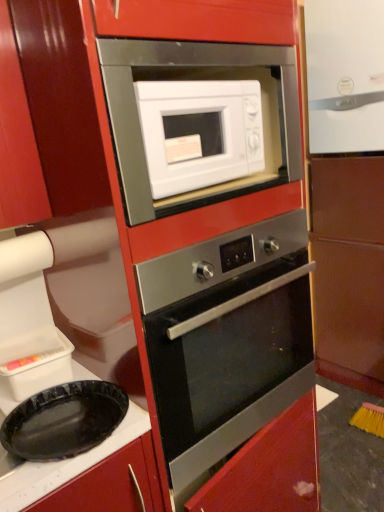
Image resolution: width=384 pixels, height=512 pixels. What do you see at coordinates (199, 133) in the screenshot?
I see `white glossy microwave at center` at bounding box center [199, 133].

The width and height of the screenshot is (384, 512). What do you see at coordinates (91, 475) in the screenshot? I see `black plastic plate at lower left` at bounding box center [91, 475].

Identify the location of white glossy refrigerator at upper right. Image resolution: width=384 pixels, height=512 pixels. (345, 75).

In order to click on matte brown cabinet at right in this screenshot , I will do `click(347, 184)`.

The height and width of the screenshot is (512, 384). What are the coordinates of `white glossy microwave at center` in the screenshot? It's located at (199, 133).

Where is `appliance above the white glossy microwave at center (from a real-world perspective)`? This screenshot has width=384, height=512. appliance above the white glossy microwave at center (from a real-world perspective) is located at coordinates (345, 75).

From a real-world perspective, which is physically above, white glossy microwave at center or white glossy refrigerator at upper right?

white glossy refrigerator at upper right is physically above.

Are white glossy microwave at center and white glossy refrigerator at upper right located far from each other?

That's right, there is a large distance between white glossy microwave at center and white glossy refrigerator at upper right.

In the image, is black plastic plate at lower left positioned in front of or behind white glossy microwave at center?

black plastic plate at lower left is in front of white glossy microwave at center.

Between black plastic plate at lower left and white glossy microwave at center, which one has larger size?

Bigger between the two is white glossy microwave at center.

Between black plastic plate at lower left and white glossy microwave at center, which one has more height?

With more height is white glossy microwave at center.

You are a GUI agent. You are given a task and a screenshot of the screen. Output one action in this format:
    pyautogui.click(x=<x>, y=<y>)
    Task: Click on the microwave oven lying on the right of black plastic plate at lower left
    This screenshot has width=384, height=512.
    Given the screenshot: What is the action you would take?
    pyautogui.click(x=199, y=133)

What's the angular difference between white glossy refrigerator at upper right and matte brown cabinet at right's facing directions?

They differ by 1.24 degrees in their facing directions.

Is point (377, 147) in front of point (380, 262)?

That is True.

From the image's perspective, which one is positioned lower, white glossy refrigerator at upper right or matte brown cabinet at right?

From the image's view, matte brown cabinet at right is below.

Considering the relative positions of white glossy refrigerator at upper right and matte brown cabinet at right in the image provided, is white glossy refrigerator at upper right behind matte brown cabinet at right?

That is True.

Does stainless steel oven at center lie in front of black plastic plate at lower left?

That is False.

From the image's perspective, is stainless steel oven at center located above or below black plastic plate at lower left?

Clearly, from the image's perspective, stainless steel oven at center is above black plastic plate at lower left.

From a real-world perspective, which is physically above, stainless steel oven at center or black plastic plate at lower left?

In real-world perspective, stainless steel oven at center is above.

The width and height of the screenshot is (384, 512). Find the location of `oven behind the black plastic plate at lower left`. oven behind the black plastic plate at lower left is located at coordinates (226, 339).

Is white glossy refrigerator at upper right in front of or behind stainless steel oven at center in the image?

white glossy refrigerator at upper right is behind stainless steel oven at center.

From the picture: Who is shorter, white glossy refrigerator at upper right or stainless steel oven at center?

Standing shorter between the two is stainless steel oven at center.

Considering the relative sizes of white glossy refrigerator at upper right and stainless steel oven at center in the image provided, is white glossy refrigerator at upper right thinner than stainless steel oven at center?

Correct, the width of white glossy refrigerator at upper right is less than that of stainless steel oven at center.

From a real-world perspective, is white glossy refrigerator at upper right above or below stainless steel oven at center?

Clearly, from a real-world perspective, white glossy refrigerator at upper right is above stainless steel oven at center.

Is white glossy refrigerator at upper right far from white glossy microwave at center?

That's right, there is a large distance between white glossy refrigerator at upper right and white glossy microwave at center.

Considering their positions, is white glossy refrigerator at upper right located in front of or behind white glossy microwave at center?

white glossy refrigerator at upper right is positioned farther from the viewer than white glossy microwave at center.

Which of these two, white glossy refrigerator at upper right or white glossy microwave at center, is thinner?

white glossy microwave at center is thinner.

Which object is positioned more to the right, white glossy refrigerator at upper right or white glossy microwave at center?

Positioned to the right is white glossy refrigerator at upper right.

From the picture: Between matte brown cabinet at right and white glossy refrigerator at upper right, which one appears on the right side from the viewer's perspective?

From the viewer's perspective, matte brown cabinet at right appears more on the right side.

Who is smaller, matte brown cabinet at right or white glossy refrigerator at upper right?

With smaller size is white glossy refrigerator at upper right.

Considering the positions of objects matte brown cabinet at right and white glossy refrigerator at upper right in the image provided, who is in front, matte brown cabinet at right or white glossy refrigerator at upper right?

Positioned in front is matte brown cabinet at right.

From a real-world perspective, is matte brown cabinet at right physically located above or below white glossy refrigerator at upper right?

matte brown cabinet at right is situated lower than white glossy refrigerator at upper right in the real world.

Where is `microwave oven that is below the white glossy refrigerator at upper right (from the image's perspective)`? The height and width of the screenshot is (512, 384). microwave oven that is below the white glossy refrigerator at upper right (from the image's perspective) is located at coordinates (199, 133).

Image resolution: width=384 pixels, height=512 pixels. In order to click on microwave oven that is on the right side of black plastic plate at lower left in this screenshot , I will do `click(199, 133)`.

Estimate the real-world distances between objects in this image. Which object is further from stainless steel oven at center, matte brown cabinet at right or white glossy microwave at center?

The object further to stainless steel oven at center is matte brown cabinet at right.

From the image, which object appears to be farther from white glossy refrigerator at upper right, stainless steel oven at center or black plastic plate at lower left?

The object further to white glossy refrigerator at upper right is black plastic plate at lower left.

Considering their positions, is stainless steel oven at center positioned further to white glossy refrigerator at upper right than white glossy microwave at center?

Among the two, stainless steel oven at center is located further to white glossy refrigerator at upper right.

Based on their spatial positions, is white glossy refrigerator at upper right or white glossy microwave at center closer to matte brown cabinet at right?

white glossy refrigerator at upper right is positioned closer to the anchor matte brown cabinet at right.

When comparing their distances from black plastic plate at lower left, does stainless steel oven at center or white glossy microwave at center seem closer?

stainless steel oven at center is closer to black plastic plate at lower left.

Considering their positions, is white glossy refrigerator at upper right positioned further to black plastic plate at lower left than white glossy microwave at center?

Among the two, white glossy refrigerator at upper right is located further to black plastic plate at lower left.

From the image, which object appears to be nearer to stainless steel oven at center, white glossy refrigerator at upper right or white glossy microwave at center?

white glossy microwave at center lies closer to stainless steel oven at center than the other object.

Estimate the real-world distances between objects in this image. Which object is further from white glossy refrigerator at upper right, white glossy microwave at center or matte brown cabinet at right?

Based on the image, white glossy microwave at center appears to be further to white glossy refrigerator at upper right.

At what (x,y) coordinates should I click in order to perform the action: click on microwave oven between white glossy refrigerator at upper right and stainless steel oven at center vertically. Please return your answer as a coordinate pair (x, y). The image size is (384, 512). Looking at the image, I should click on pyautogui.click(x=199, y=133).

The height and width of the screenshot is (512, 384). Identify the location of appliance between black plastic plate at lower left and matte brown cabinet at right from left to right. 345,75.

Where is `microwave oven between white glossy refrigerator at upper right and black plastic plate at lower left in the vertical direction`? This screenshot has width=384, height=512. microwave oven between white glossy refrigerator at upper right and black plastic plate at lower left in the vertical direction is located at coordinates (199, 133).

This screenshot has width=384, height=512. I want to click on appliance between white glossy microwave at center and matte brown cabinet at right, so click(x=345, y=75).